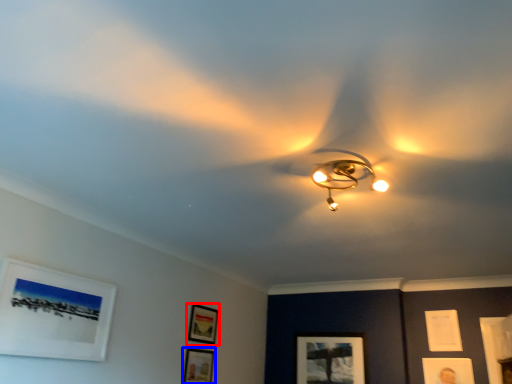
Question: Among these objects, which one is nearest to the camera, picture frame (highlighted by a red box) or picture frame (highlighted by a blue box)?

Choices:
 (A) picture frame
 (B) picture frame

Answer: (B)